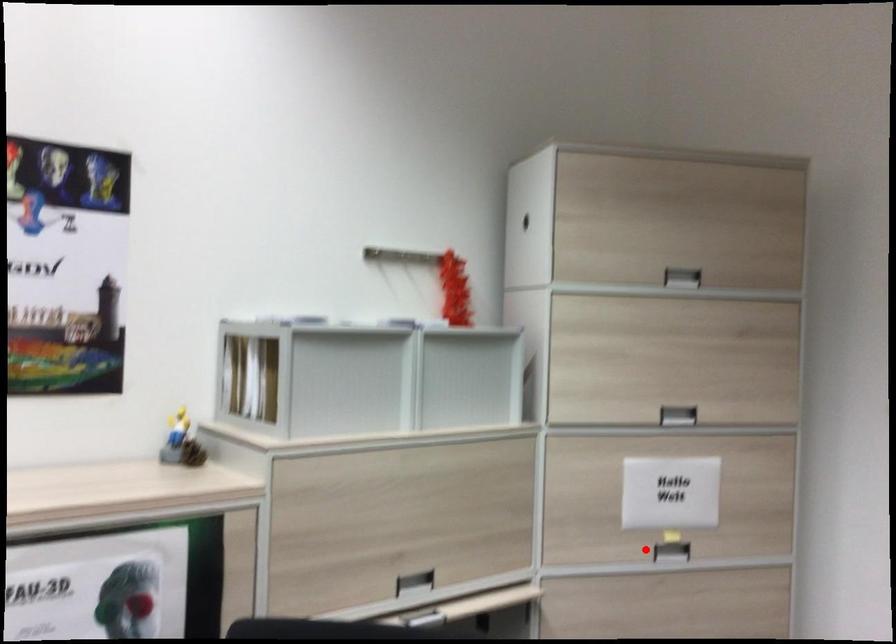
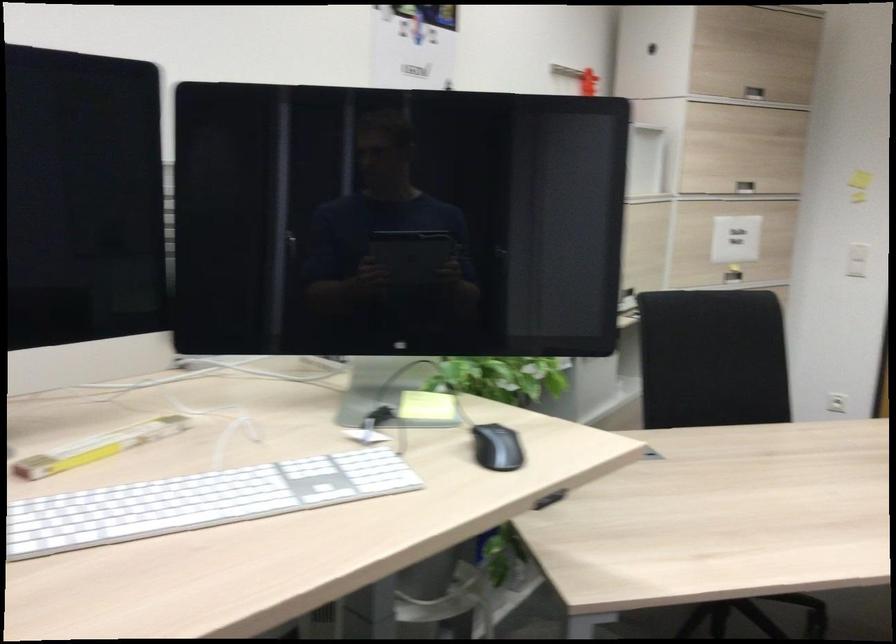
Question: I am providing you with two images of the same scene from different viewpoints. Image1 has a red point marked. In image2, the corresponding 3D location appears at what relative position? Reply with the corresponding letter.

Choices:
 (A) Closer
 (B) Farther

Answer: (B)